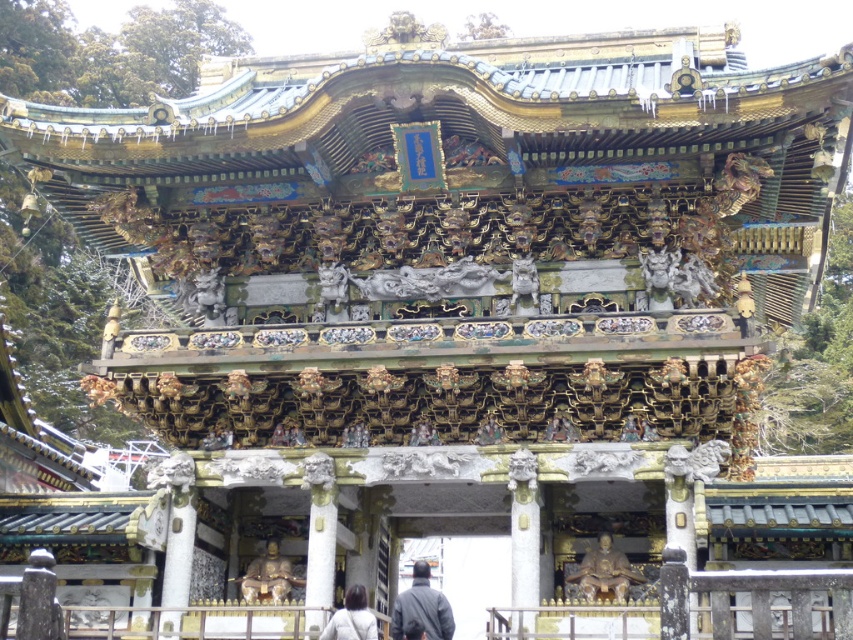
Question: Among these objects, which one is farthest from the camera?

Choices:
 (A) dark gray jacket at center
 (B) gold polished statue at center
 (C) dark gray fabric jacket at lower center

Answer: (B)

Question: Estimate the real-world distances between objects in this image. Which object is farther from the gold polished statue at center?

Choices:
 (A) dark gray fabric jacket at lower center
 (B) dark gray jacket at center

Answer: (A)

Question: Does gold polished statue at center appear under dark gray fabric jacket at lower center?

Choices:
 (A) no
 (B) yes

Answer: (A)

Question: Does gold polished statue at center appear under gold metallic statue at center?

Choices:
 (A) yes
 (B) no

Answer: (B)

Question: Does gold metallic statue at center lie in front of dark gray fabric jacket at lower center?

Choices:
 (A) yes
 (B) no

Answer: (B)

Question: Among these points, which one is farthest from the camera?

Choices:
 (A) (601, 547)
 (B) (363, 593)
 (C) (427, 582)
 (D) (260, 593)

Answer: (A)